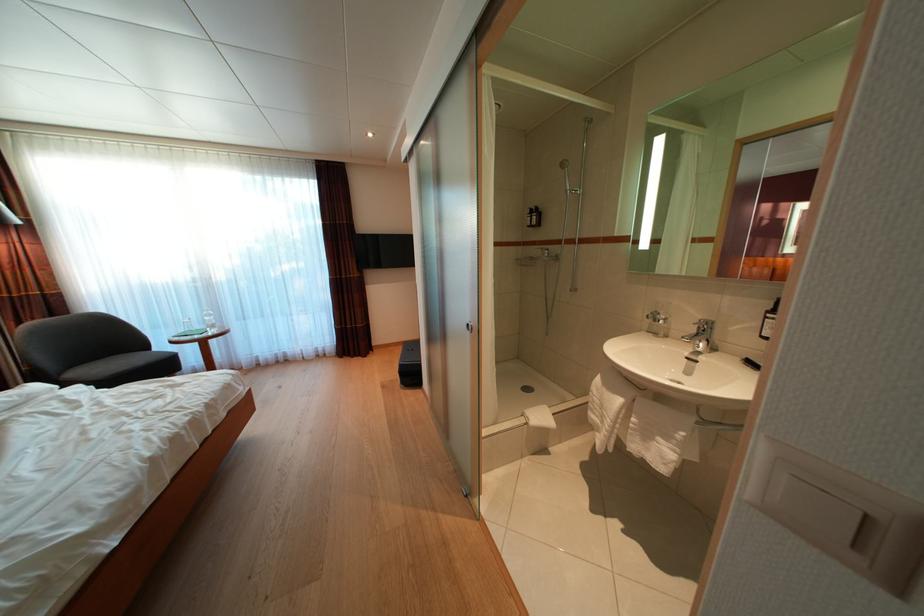
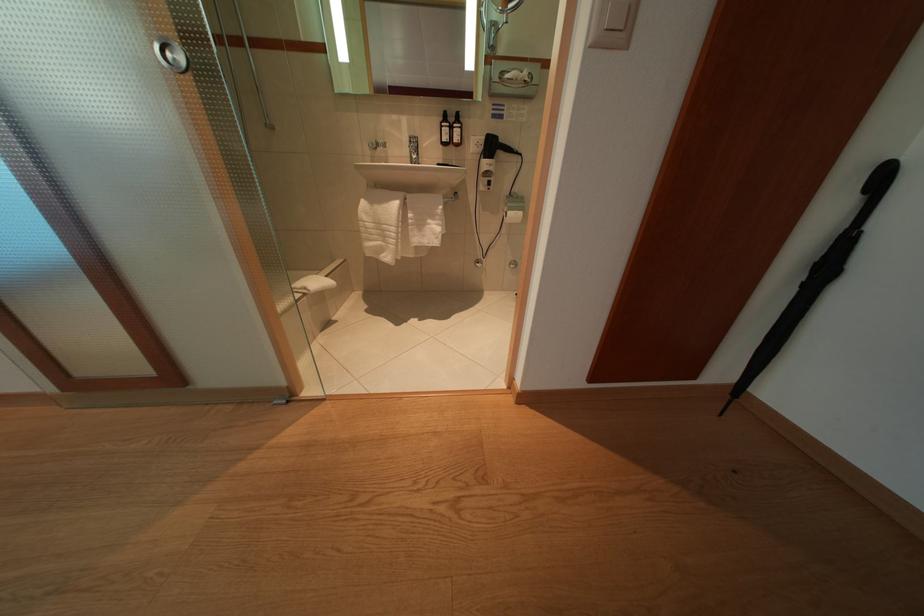
First-person continuous shooting, in which direction is the camera rotating?

The camera rotated toward right-down.